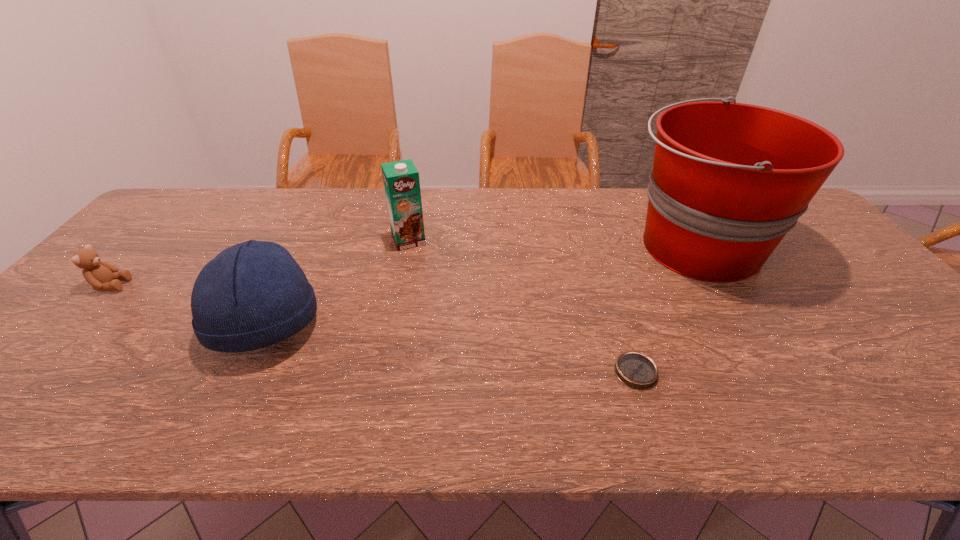
In the image, there is a desktop. Identify the location of vacant area at the far left corner. coord(214,188).

In the image, there is a desktop. In order to click on vacant space at the near right corner in this screenshot , I will do `click(930, 404)`.

The image size is (960, 540). I want to click on free space between the fourth shortest object and the skullcap, so click(x=337, y=282).

The width and height of the screenshot is (960, 540). I want to click on free area in between the teddy bear and the rightmost object, so click(x=403, y=266).

Find the location of `empty space between the fourth tallest object and the compass`. empty space between the fourth tallest object and the compass is located at coordinates (373, 329).

I want to click on blank region between the rightmost object and the third object from right to left, so click(x=552, y=243).

The image size is (960, 540). I want to click on unoccupied position between the second object from left to right and the tallest object, so click(481, 285).

Identify the location of unoccupied position between the third tallest object and the shortest object. The image size is (960, 540). (451, 348).

Find the location of a particular element. This screenshot has width=960, height=540. vacant area between the compass and the second tallest object is located at coordinates (522, 306).

The image size is (960, 540). Identify the location of vacant area between the shortest object and the fourth object from right to left. (451, 348).